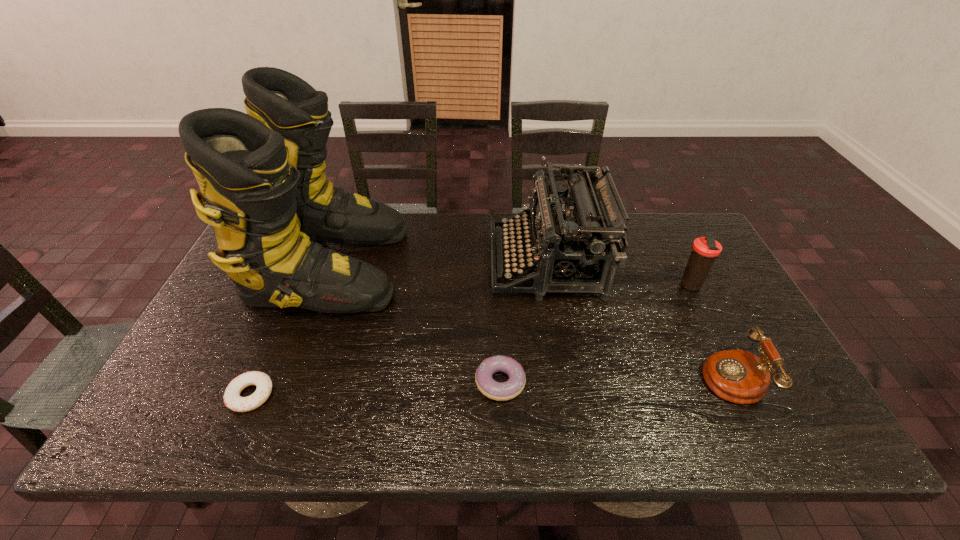
In the image, there is a desktop. At what (x,y) coordinates should I click in order to perform the action: click on free region at the near edge. Please return your answer as a coordinate pair (x, y). Image resolution: width=960 pixels, height=540 pixels. Looking at the image, I should click on (616, 444).

I want to click on vacant space at the left edge of the desktop, so click(x=227, y=316).

This screenshot has height=540, width=960. In the image, there is a desktop. Find the location of `free space at the right edge`. free space at the right edge is located at coordinates tap(729, 320).

This screenshot has height=540, width=960. In the image, there is a desktop. What are the coordinates of `vacant space at the near right corner` in the screenshot? It's located at (818, 435).

Where is `vacant area that lies between the telephone and the third tallest object`? The width and height of the screenshot is (960, 540). vacant area that lies between the telephone and the third tallest object is located at coordinates (709, 330).

This screenshot has width=960, height=540. In order to click on vacant area between the left doughnut and the fourth shortest object in this screenshot , I will do `click(470, 340)`.

The image size is (960, 540). What are the coordinates of `free space between the fourth shortest object and the fourth tallest object` in the screenshot? It's located at (709, 330).

At what (x,y) coordinates should I click in order to perform the action: click on empty space between the tallest object and the shorter doughnut. Please return your answer as a coordinate pair (x, y). Looking at the image, I should click on (290, 330).

Image resolution: width=960 pixels, height=540 pixels. I want to click on empty space between the telephone and the tallest object, so click(529, 320).

Locate an element on the screen. The image size is (960, 540). unoccupied area between the typewriter and the thermos bottle is located at coordinates click(618, 274).